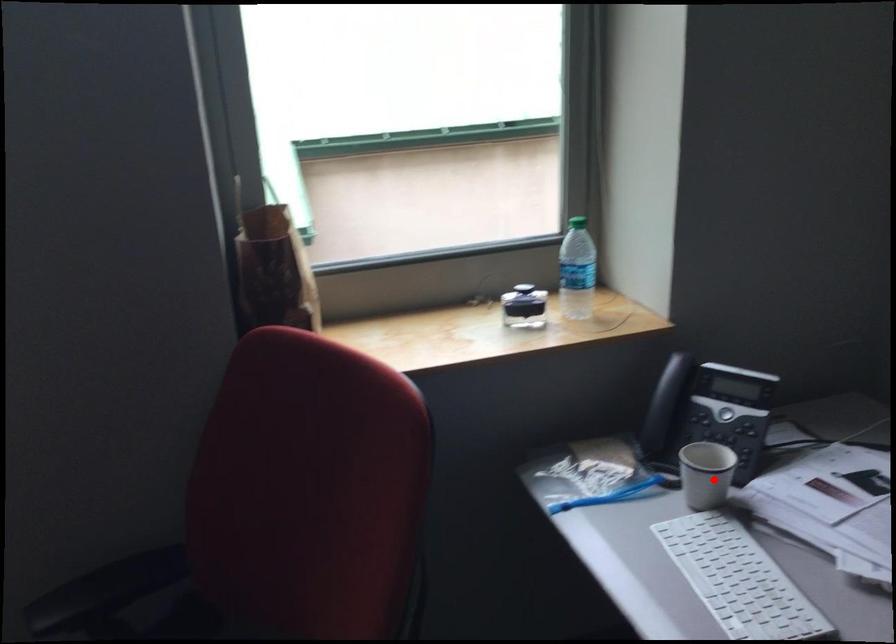
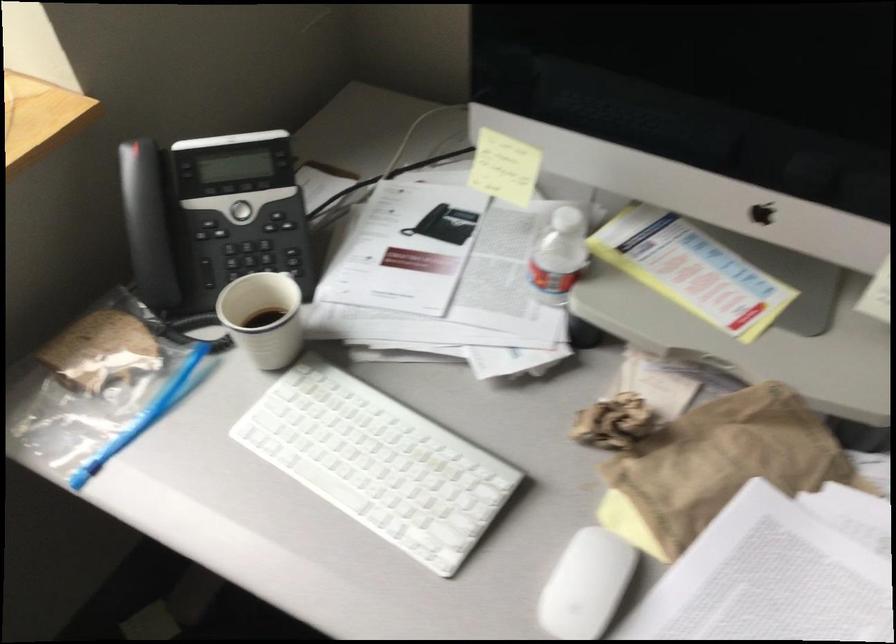
Question: I am providing you with two images of the same scene from different viewpoints. In image1, a red point is highlighted. Considering the same 3D point in image2, which of the following is correct?

Choices:
 (A) It is closer
 (B) It is farther

Answer: (A)